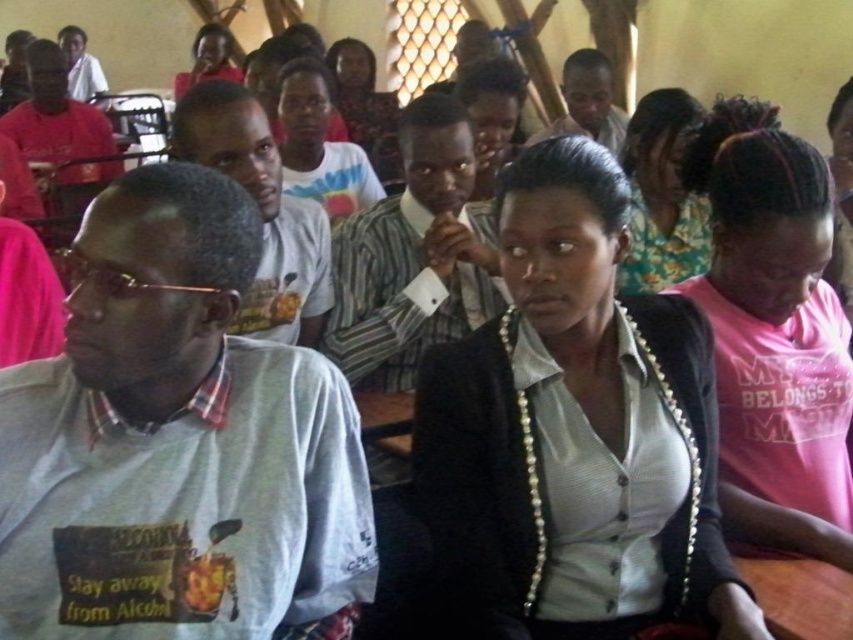
Is point (206, 93) in front of point (653, 145)?

That is True.

Who is higher up, matte gray shirt at center or floral fabric dress at upper right?

floral fabric dress at upper right is higher up.

Is point (317, 289) farther from viewer compared to point (676, 211)?

No, it is in front of (676, 211).

Find the location of a particular element. The height and width of the screenshot is (640, 853). matte gray shirt at center is located at coordinates (260, 211).

Is black matte blazer at center bigger than matte gray shirt at center?

Yes.

Does black matte blazer at center have a smaller size compared to matte gray shirt at center?

No, black matte blazer at center is not smaller than matte gray shirt at center.

Where is `black matte blazer at center`? The height and width of the screenshot is (640, 853). black matte blazer at center is located at coordinates click(575, 429).

At what (x,y) coordinates should I click in order to perform the action: click on black matte blazer at center. Please return your answer as a coordinate pair (x, y). The width and height of the screenshot is (853, 640). Looking at the image, I should click on (575, 429).

Is matte black shirt at upper center positioned in front of matte gray shirt at upper center?

That is False.

Who is more distant from viewer, [358,77] or [601,141]?

Point [358,77]

Measure the distance between matte black shirt at upper center and camera.

A distance of 3.84 meters exists between matte black shirt at upper center and camera.

Locate an element on the screen. This screenshot has width=853, height=640. matte black shirt at upper center is located at coordinates pyautogui.click(x=364, y=108).